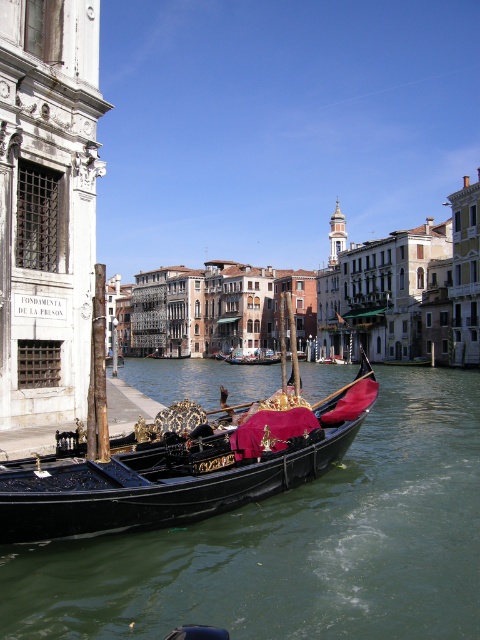
Question: Which of the following is the closest to the observer?

Choices:
 (A) black polished gondola at lower left
 (B) black velvet gondola at center
 (C) green water at gondola center

Answer: (C)

Question: In this image, where is green water at gondola center located relative to black polished gondola at lower left?

Choices:
 (A) below
 (B) above

Answer: (A)

Question: Which object is positioned farthest from the green water at gondola center?

Choices:
 (A) black velvet gondola at center
 (B) black polished gondola at lower left

Answer: (A)

Question: Based on their relative distances, which object is farther from the black velvet gondola at center?

Choices:
 (A) green water at gondola center
 (B) black polished gondola at lower left

Answer: (B)

Question: From the image, what is the correct spatial relationship of green water at gondola center in relation to black polished gondola at lower left?

Choices:
 (A) right
 (B) left

Answer: (B)

Question: Can you confirm if green water at gondola center is smaller than black polished gondola at lower left?

Choices:
 (A) yes
 (B) no

Answer: (B)